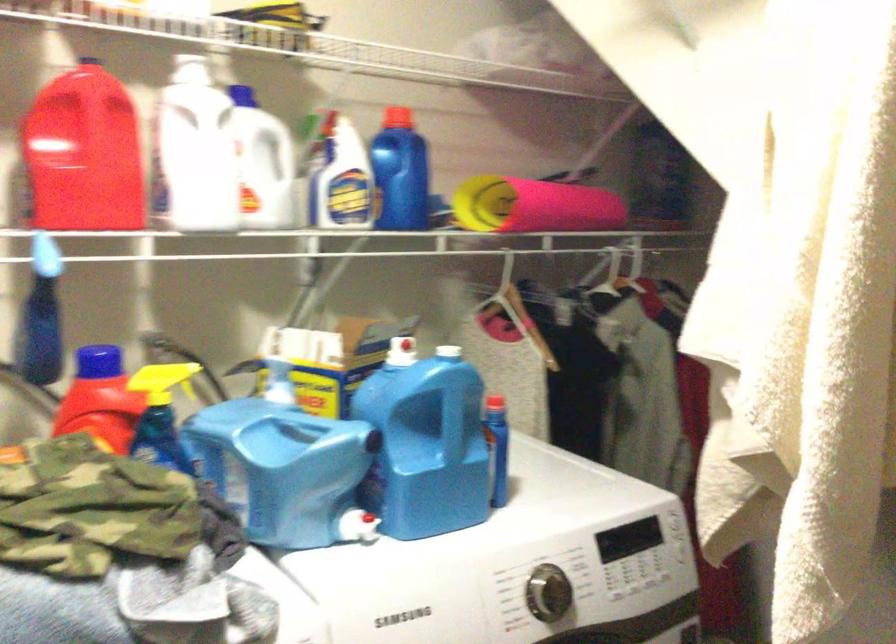
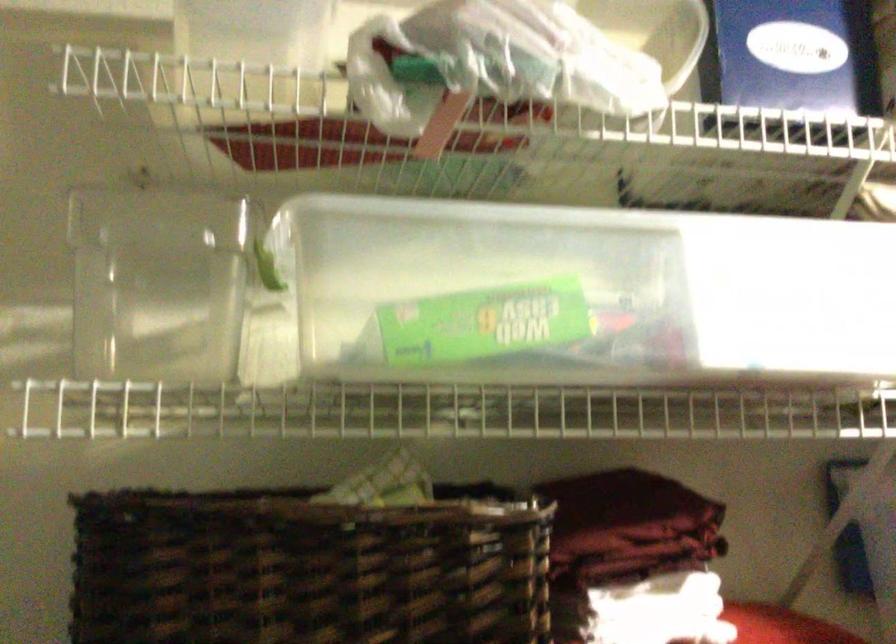
Question: The images are taken continuously from a first-person perspective. In which direction is your viewpoint rotating?

Choices:
 (A) Left
 (B) Right
 (C) Up
 (D) Down

Answer: (A)